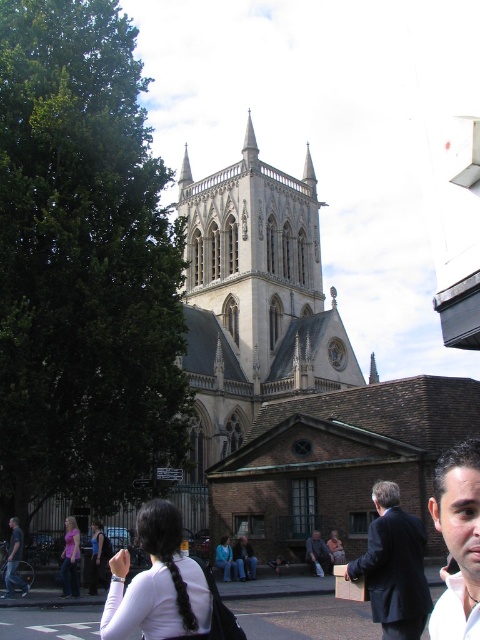
Who is positioned more to the right, light pink fabric shirt at lower left or dark blue suit at center?

dark blue suit at center is more to the right.

What do you see at coordinates (70, 560) in the screenshot? I see `light pink fabric shirt at lower left` at bounding box center [70, 560].

You are a GUI agent. You are given a task and a screenshot of the screen. Output one action in this format:
    pyautogui.click(x=<x>, y=<y>)
    Task: Click on the light pink fabric shirt at lower left
    This screenshot has height=640, width=480.
    Given the screenshot: What is the action you would take?
    pyautogui.click(x=70, y=560)

Looking at this image, can you confirm if matte black suit at center is shorter than smooth skin face at lower right?

Indeed, matte black suit at center has a lesser height compared to smooth skin face at lower right.

Between matte black suit at center and smooth skin face at lower right, which one appears on the right side from the viewer's perspective?

Positioned to the right is smooth skin face at lower right.

Who is more distant from viewer, (419,632) or (479,577)?

Positioned behind is point (419,632).

Identify the location of matte black suit at center. This screenshot has width=480, height=640. (394, 566).

Can you confirm if matte black suit at center is positioned to the left of dark blue suit at center?

In fact, matte black suit at center is to the right of dark blue suit at center.

Which is behind, point (386, 588) or point (321, 563)?

Positioned behind is point (321, 563).

At what (x,y) coordinates should I click in order to perform the action: click on matte black suit at center. Please return your answer as a coordinate pair (x, y). This screenshot has height=640, width=480. Looking at the image, I should click on (394, 566).